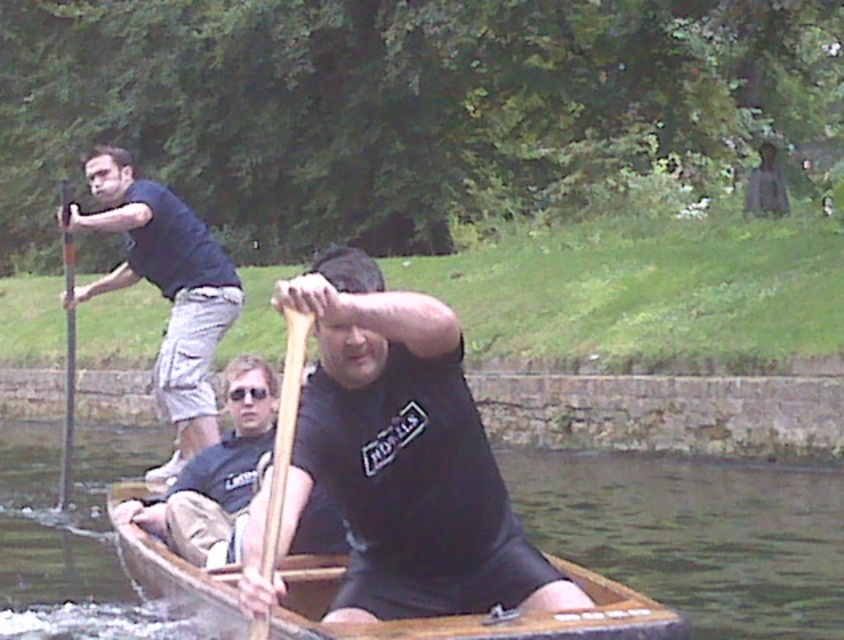
Question: Which object is farther from the camera taking this photo?

Choices:
 (A) matte black oar at center
 (B) wooden paddle at left
 (C) dark blue t-shirt at left
 (D) dark gray cotton shirt at center

Answer: (B)

Question: Does wooden at left have a greater width compared to wooden paddle at left?

Choices:
 (A) no
 (B) yes

Answer: (A)

Question: Which point is closer to the camera?

Choices:
 (A) wooden at left
 (B) dark gray cotton shirt at center

Answer: (A)

Question: Which object appears closest to the camera in this image?

Choices:
 (A) wooden paddle at left
 (B) matte black oar at center
 (C) dark blue t-shirt at left

Answer: (B)

Question: Can you confirm if dark blue t-shirt at left is positioned to the left of dark gray cotton shirt at center?

Choices:
 (A) no
 (B) yes

Answer: (B)

Question: Is wooden at left wider than wooden paddle at left?

Choices:
 (A) yes
 (B) no

Answer: (B)